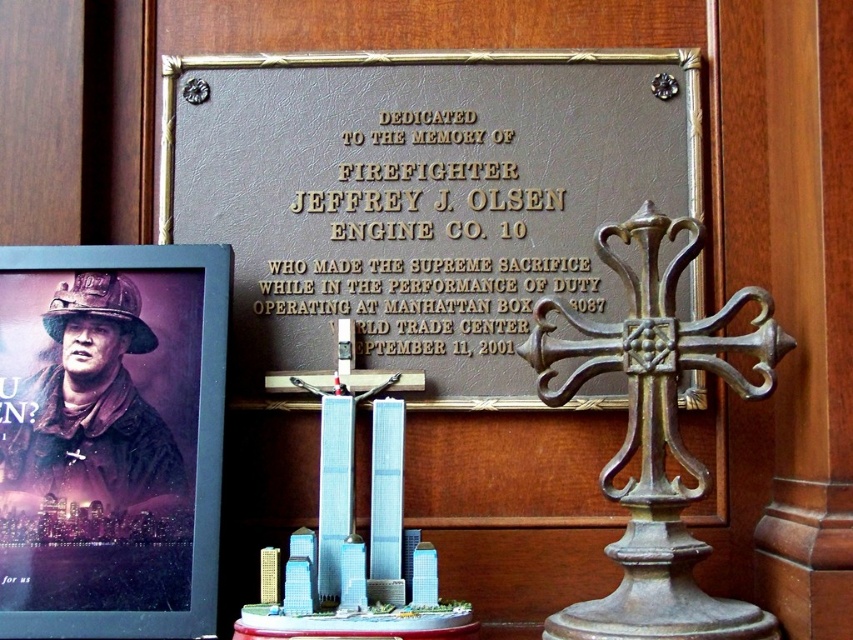
Which is in front, point (256, 300) or point (190, 548)?

Point (190, 548) is in front.

Is brown leather plaque at center bigger than matte black poster at left?

Yes.

Which is in front, point (531, 193) or point (16, 428)?

Positioned in front is point (16, 428).

Where is `brown leather plaque at center`? brown leather plaque at center is located at coordinates (421, 196).